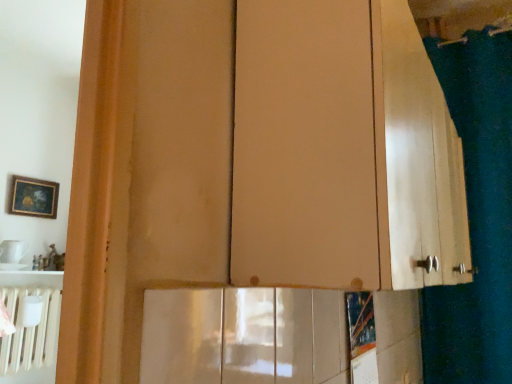
Locate an element on the screen. The width and height of the screenshot is (512, 384). matte wood cabinet at center is located at coordinates (304, 146).

What do you see at coordinates (304, 146) in the screenshot? The width and height of the screenshot is (512, 384). I see `matte wood cabinet at center` at bounding box center [304, 146].

What are the coordinates of `green fabric shower curtain at right` in the screenshot? It's located at (476, 214).

This screenshot has height=384, width=512. Describe the element at coordinates (476, 214) in the screenshot. I see `green fabric shower curtain at right` at that location.

In order to face green fabric shower curtain at right, should I rotate leftwards or rightwards?

Turn right approximately 26.443 degrees to face it.

The height and width of the screenshot is (384, 512). Identify the location of matte wood cabinet at center. (304, 146).

Which is more to the right, green fabric shower curtain at right or matte wood cabinet at center?

From the viewer's perspective, green fabric shower curtain at right appears more on the right side.

Considering the positions of objects green fabric shower curtain at right and matte wood cabinet at center in the image provided, who is behind, green fabric shower curtain at right or matte wood cabinet at center?

green fabric shower curtain at right is behind.

Considering the positions of point (465, 304) and point (236, 176), is point (465, 304) closer or farther from the camera than point (236, 176)?

Point (465, 304).

From the image's perspective, is green fabric shower curtain at right below matte wood cabinet at center?

Yes, from the image's perspective, green fabric shower curtain at right is beneath matte wood cabinet at center.

From a real-world perspective, is green fabric shower curtain at right physically above matte wood cabinet at center?

Correct, in the physical world, green fabric shower curtain at right is higher than matte wood cabinet at center.

Considering the relative sizes of green fabric shower curtain at right and matte wood cabinet at center in the image provided, is green fabric shower curtain at right thinner than matte wood cabinet at center?

Indeed, green fabric shower curtain at right has a lesser width compared to matte wood cabinet at center.

Is green fabric shower curtain at right taller or shorter than matte wood cabinet at center?

Considering their sizes, green fabric shower curtain at right has more height than matte wood cabinet at center.

Considering the sizes of objects green fabric shower curtain at right and matte wood cabinet at center in the image provided, who is bigger, green fabric shower curtain at right or matte wood cabinet at center?

matte wood cabinet at center is bigger.

Does green fabric shower curtain at right contain matte wood cabinet at center?

No.

Is green fabric shower curtain at right far away from matte wood cabinet at center?

Indeed, green fabric shower curtain at right is not near matte wood cabinet at center.

Is green fabric shower curtain at right looking in the opposite direction of matte wood cabinet at center?

Yes, green fabric shower curtain at right is facing away from matte wood cabinet at center.

How many degrees apart are the facing directions of green fabric shower curtain at right and matte wood cabinet at center?

The facing directions of green fabric shower curtain at right and matte wood cabinet at center are 91.2 degrees apart.

Locate an element on the screen. screen door on the left of green fabric shower curtain at right is located at coordinates (304, 146).

Between matte wood cabinet at center and green fabric shower curtain at right, which one appears on the left side from the viewer's perspective?

From the viewer's perspective, matte wood cabinet at center appears more on the left side.

Who is more distant, matte wood cabinet at center or green fabric shower curtain at right?

green fabric shower curtain at right.

Which is nearer, [231,216] or [496,284]?

Point [231,216]

From the image's perspective, who appears lower, matte wood cabinet at center or green fabric shower curtain at right?

From the image's view, green fabric shower curtain at right is below.

From a real-world perspective, is matte wood cabinet at center over green fabric shower curtain at right?

Actually, matte wood cabinet at center is physically below green fabric shower curtain at right in the real world.

Is matte wood cabinet at center thinner than green fabric shower curtain at right?

Incorrect, the width of matte wood cabinet at center is not less than that of green fabric shower curtain at right.

Can you confirm if matte wood cabinet at center is taller than green fabric shower curtain at right?

Incorrect, the height of matte wood cabinet at center is not larger of that of green fabric shower curtain at right.

Between matte wood cabinet at center and green fabric shower curtain at right, which one has larger size?

Bigger between the two is matte wood cabinet at center.

Choose the correct answer: Is matte wood cabinet at center inside green fabric shower curtain at right or outside it?

matte wood cabinet at center lies outside green fabric shower curtain at right.

Are matte wood cabinet at center and green fabric shower curtain at right beside each other?

There is a gap between matte wood cabinet at center and green fabric shower curtain at right.

Is matte wood cabinet at center positioned with its back to green fabric shower curtain at right?

No, matte wood cabinet at center is not facing away from green fabric shower curtain at right.

The width and height of the screenshot is (512, 384). Find the location of `shower curtain behind the matte wood cabinet at center`. shower curtain behind the matte wood cabinet at center is located at coordinates click(476, 214).

Where is `shower curtain above the matte wood cabinet at center (from a real-world perspective)`? Image resolution: width=512 pixels, height=384 pixels. shower curtain above the matte wood cabinet at center (from a real-world perspective) is located at coordinates (476, 214).

Locate an element on the screen. This screenshot has height=384, width=512. screen door that appears above the green fabric shower curtain at right (from the image's perspective) is located at coordinates (304, 146).